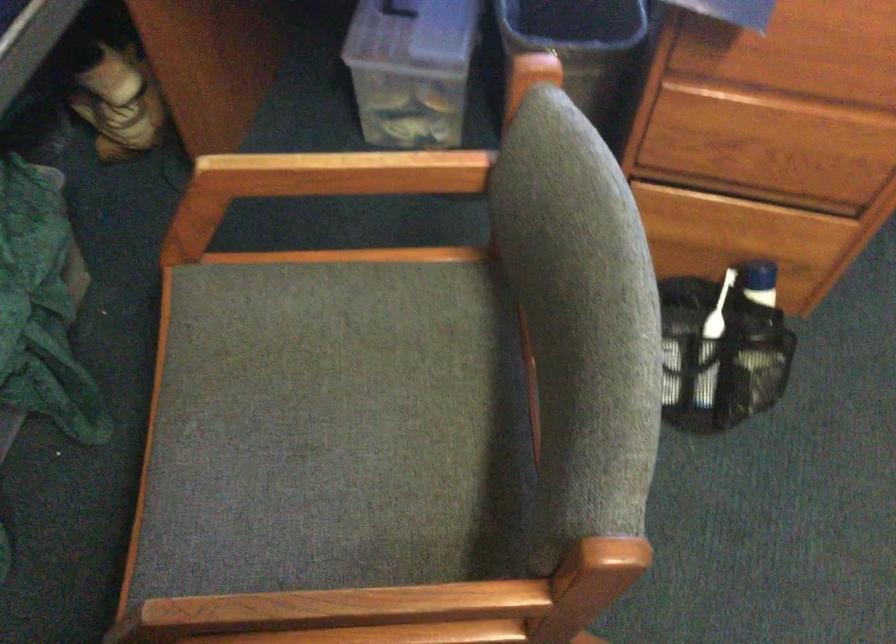
What do you see at coordinates (347, 406) in the screenshot? I see `the gray chair sitting surface` at bounding box center [347, 406].